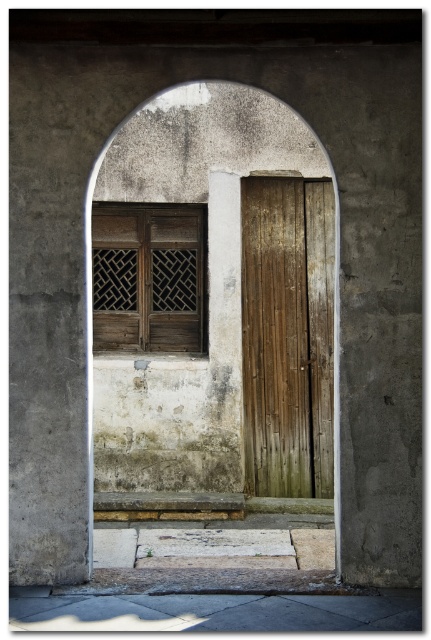
Which is more to the right, smooth concrete archway at center or weathered wood door at center?

From the viewer's perspective, weathered wood door at center appears more on the right side.

Based on the photo, can you confirm if smooth concrete archway at center is bigger than weathered wood door at center?

Indeed, smooth concrete archway at center has a larger size compared to weathered wood door at center.

I want to click on smooth concrete archway at center, so click(214, 300).

This screenshot has width=431, height=640. Identify the location of smooth concrete archway at center. (214, 300).

Which of these two, wooden lattice at center or gray concrete at lower center, stands taller?

Standing taller between the two is wooden lattice at center.

Who is shorter, wooden lattice at center or gray concrete at lower center?

gray concrete at lower center is shorter.

Does point (149, 300) come closer to viewer compared to point (11, 611)?

No, it is behind (11, 611).

Locate an element on the screen. wooden lattice at center is located at coordinates (147, 276).

Is weathered wood door at center below wooden lattice at center?

Correct, weathered wood door at center is located below wooden lattice at center.

Consider the image. Can you confirm if weathered wood door at center is thinner than wooden lattice at center?

Indeed, weathered wood door at center has a lesser width compared to wooden lattice at center.

Is point (277, 282) positioned after point (178, 314)?

No, it is not.

Find the location of `weathered wood door at center`. weathered wood door at center is located at coordinates (287, 336).